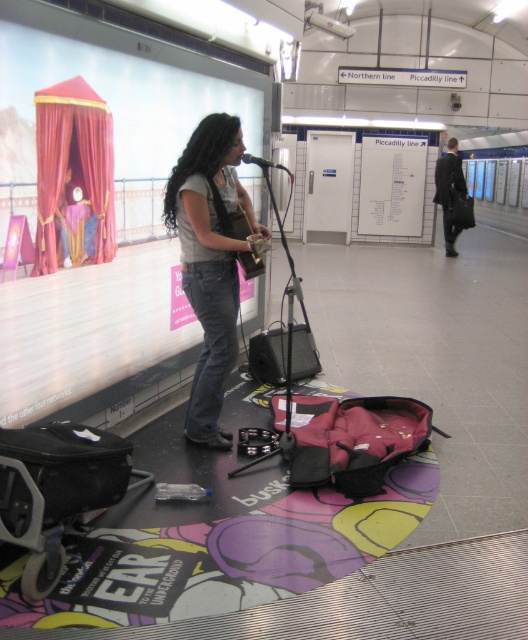
You are a photographer positioned at the subway platform. You want to capture a closeup of the matte gray shirt at center and the wooden acoustic guitar at center in the same frame. Can you fit both objects in the shot without moving your camera position?

The matte gray shirt at center might be wider than wooden acoustic guitar at center, so it is possible that both can fit in the frame if the camera is positioned to include both. However, the exact fit depends on the shirt width relative to the guitar and the camera lens used.

Looking at this image, you are a photographer standing at the subway platform. You need to capture a photo that includes both the matte gray shirt at center and the dark suit at right. Based on their positions, which one should you adjust your camera angle to focus on first to ensure both are in the frame?

The matte gray shirt at center is positioned on the left side of dark suit at right. To include both in the frame, you should first focus on the matte gray shirt at center to ensure it stays within the camera angle before adjusting to include the dark suit at right on the right side.

You are a photographer positioned at the center of the subway platform. You want to capture a photo of the matte gray shirt at center without including the open red backpack in the background. Is the position at point (x=211, y=260) suitable for this purpose?

The position at point (x=211, y=260) is where the matte gray shirt at center is located. Since the open red backpack is mentioned as being beside the woman and in the foreground, positioning the camera at the shirt might still include the backpack in the frame unless adjusted. However, without specific spatial details about their arrangement, it is uncertain. The answer cannot be definitively determined with the given information.